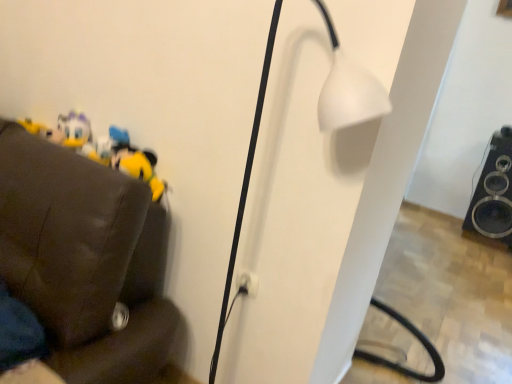
Question: Does black glossy speaker at lower right have a lesser width compared to yellow plush toy at left?

Choices:
 (A) no
 (B) yes

Answer: (A)

Question: From the image's perspective, is black glossy speaker at lower right located beneath yellow plush toy at left?

Choices:
 (A) yes
 (B) no

Answer: (A)

Question: Is black glossy speaker at lower right bigger than yellow plush toy at left?

Choices:
 (A) yes
 (B) no

Answer: (A)

Question: Considering the relative sizes of black glossy speaker at lower right and yellow plush toy at left in the image provided, is black glossy speaker at lower right wider than yellow plush toy at left?

Choices:
 (A) no
 (B) yes

Answer: (B)

Question: Can we say black glossy speaker at lower right lies outside yellow plush toy at left?

Choices:
 (A) yes
 (B) no

Answer: (A)

Question: Is black glossy speaker at lower right not near yellow plush toy at left?

Choices:
 (A) no
 (B) yes

Answer: (B)

Question: Is black glossy speaker at lower right inside white matte lamp at center?

Choices:
 (A) yes
 (B) no

Answer: (B)

Question: Is white matte lamp at center touching black glossy speaker at lower right?

Choices:
 (A) no
 (B) yes

Answer: (A)

Question: Is black glossy speaker at lower right at the back of white matte lamp at center?

Choices:
 (A) no
 (B) yes

Answer: (B)

Question: Considering the relative sizes of white matte lamp at center and black glossy speaker at lower right in the image provided, is white matte lamp at center taller than black glossy speaker at lower right?

Choices:
 (A) no
 (B) yes

Answer: (B)

Question: Can you confirm if white matte lamp at center is wider than black glossy speaker at lower right?

Choices:
 (A) no
 (B) yes

Answer: (A)

Question: Is white matte lamp at center positioned before black glossy speaker at lower right?

Choices:
 (A) no
 (B) yes

Answer: (B)

Question: Is white matte lamp at center not within yellow plush toy at left?

Choices:
 (A) no
 (B) yes

Answer: (B)